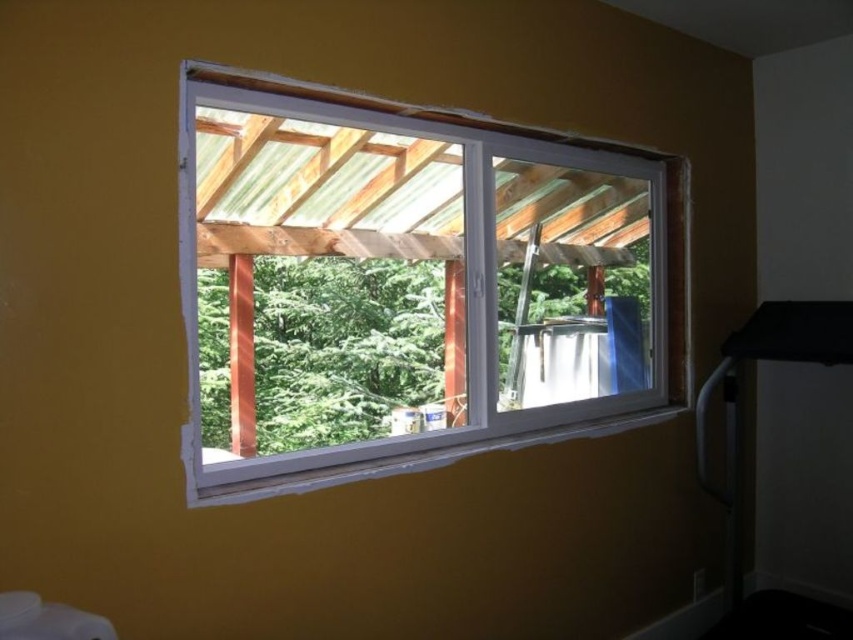
The image size is (853, 640). I want to click on white plastic window at center, so click(408, 284).

Is white plastic window at center closer to camera compared to blue fabric curtain at right?

That is True.

Who is more forward, (368, 412) or (606, 298)?

Point (368, 412)

The height and width of the screenshot is (640, 853). I want to click on white plastic window at center, so click(408, 284).